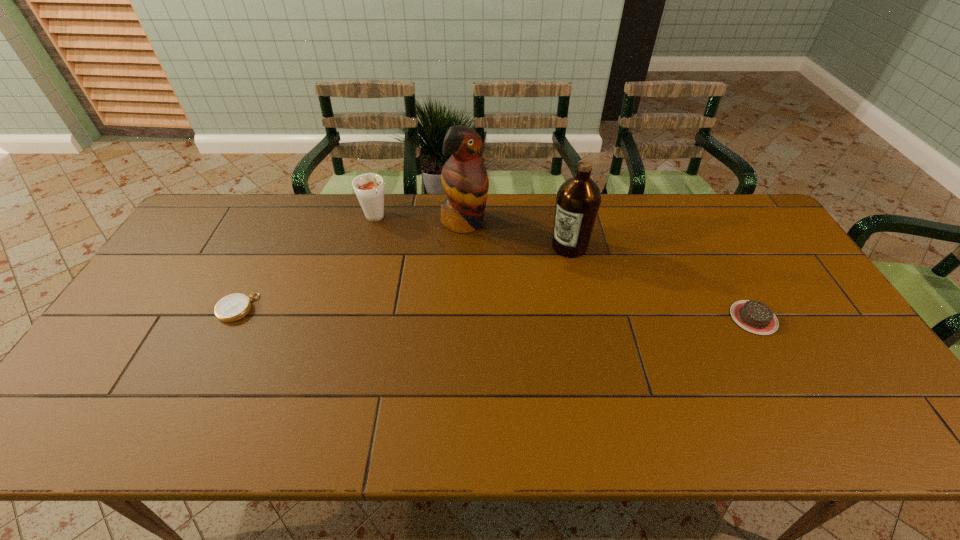
Image resolution: width=960 pixels, height=540 pixels. Identify the location of free space located on the front of the leftmost object. (220, 341).

This screenshot has height=540, width=960. I want to click on vacant position located 0.330m on the back of the fourth tallest object, so click(703, 226).

The image size is (960, 540). In order to click on vacant area located on the label of the olive oil in this screenshot , I will do `click(523, 293)`.

Image resolution: width=960 pixels, height=540 pixels. Identify the location of vacant area located 0.160m on the label of the olive oil. (529, 287).

The image size is (960, 540). Identify the location of vacant space located on the label of the olive oil. (519, 297).

At what (x,y) coordinates should I click in order to perform the action: click on vacant space located 0.230m on the face of the third object from left to right. Please return your answer as a coordinate pair (x, y). Looking at the image, I should click on (516, 279).

The image size is (960, 540). What are the coordinates of `blank space located on the face of the third object from left to right` in the screenshot? It's located at (548, 315).

Image resolution: width=960 pixels, height=540 pixels. I want to click on vacant space positioned 0.230m on the face of the third object from left to right, so click(x=516, y=279).

What are the coordinates of `free spot located on the drink side of the second object from left to right` in the screenshot? It's located at (423, 293).

You are a GUI agent. You are given a task and a screenshot of the screen. Output one action in this format:
    pyautogui.click(x=<x>, y=<y>)
    Task: Click on the free space located 0.090m on the drink side of the second object from left to right
    The height and width of the screenshot is (540, 960).
    Given the screenshot: What is the action you would take?
    pyautogui.click(x=392, y=242)